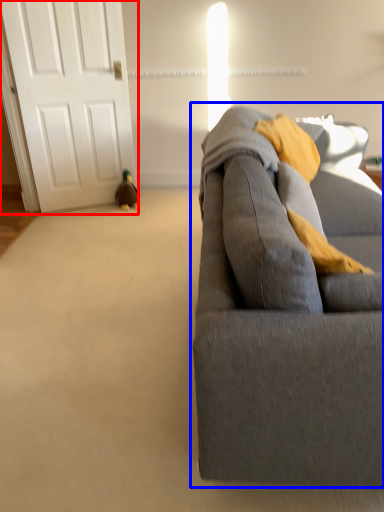
Question: Among these objects, which one is nearest to the camera, door (highlighted by a red box) or studio couch (highlighted by a blue box)?

Choices:
 (A) door
 (B) studio couch

Answer: (B)